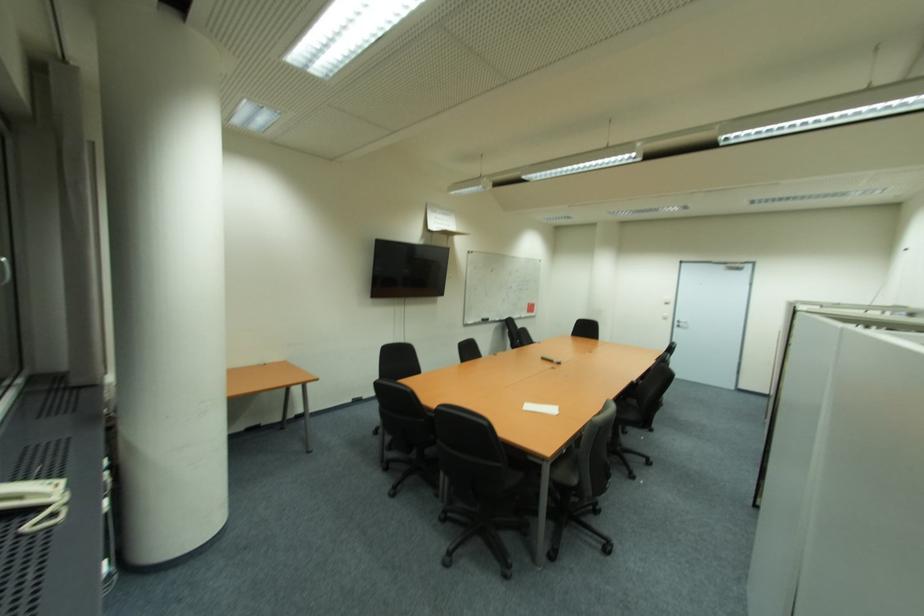
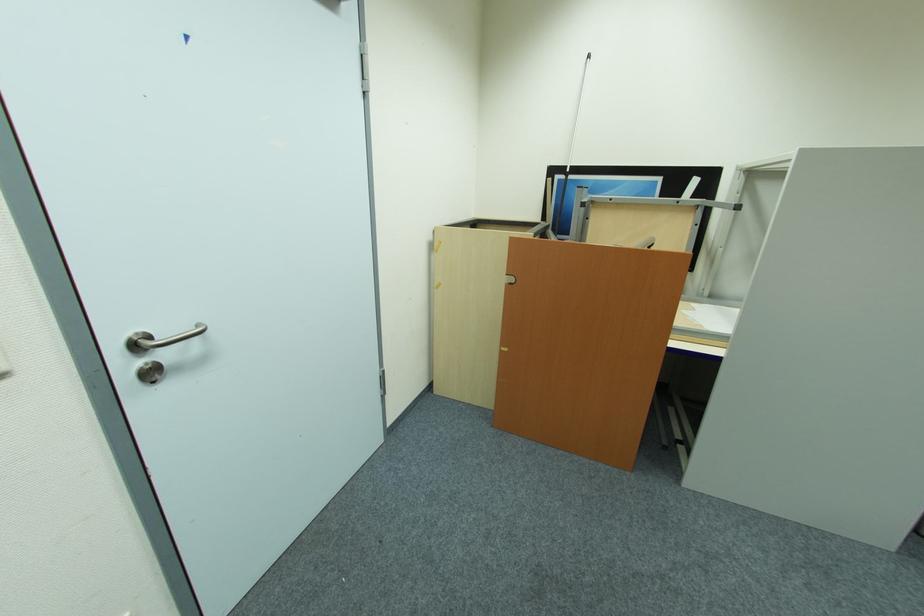
Locate, in the second image, the point that corresponds to (x=684, y=322) in the first image.

(141, 347)